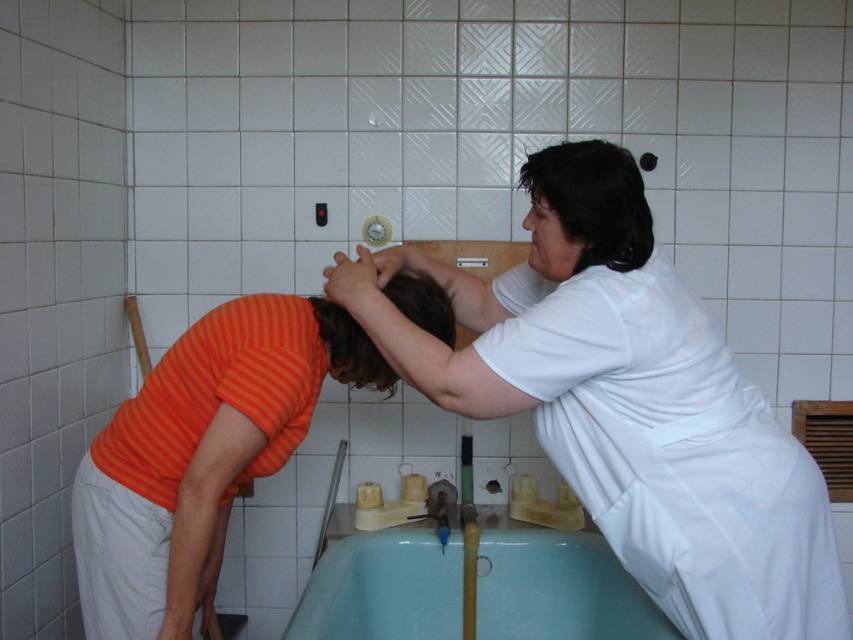
You are designing a bathroom layout and need to place the teal plastic bath at lower center and the dark brown hair at center. Based on their widths, which object requires more horizontal space?

The teal plastic bath at lower center requires more horizontal space because its width surpasses that of the dark brown hair at center.

You are a delivery person who needs to place a small package between the orange striped shirt at lower left and the black matte hair at upper right. The package is 10 inches long. Can you fit it in the space between them?

The distance between the orange striped shirt at lower left and the black matte hair at upper right is 21.27 inches. Since the package is 10 inches long, it can easily fit within the available space.

You are a healthcare worker in a hospital bathroom. You see the white matte shirt at upper right and the black matte hair at upper right. Which one is closer to the floor?

The white matte shirt at upper right is below the black matte hair at upper right, so the white matte shirt at upper right is closer to the floor.